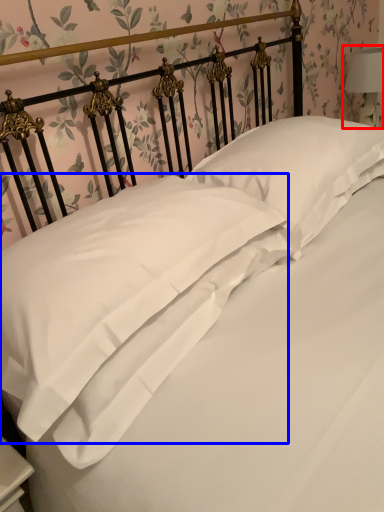
Question: Which object appears closest to the camera in this image, bedside lamp (highlighted by a red box) or pillow (highlighted by a blue box)?

Choices:
 (A) bedside lamp
 (B) pillow

Answer: (B)